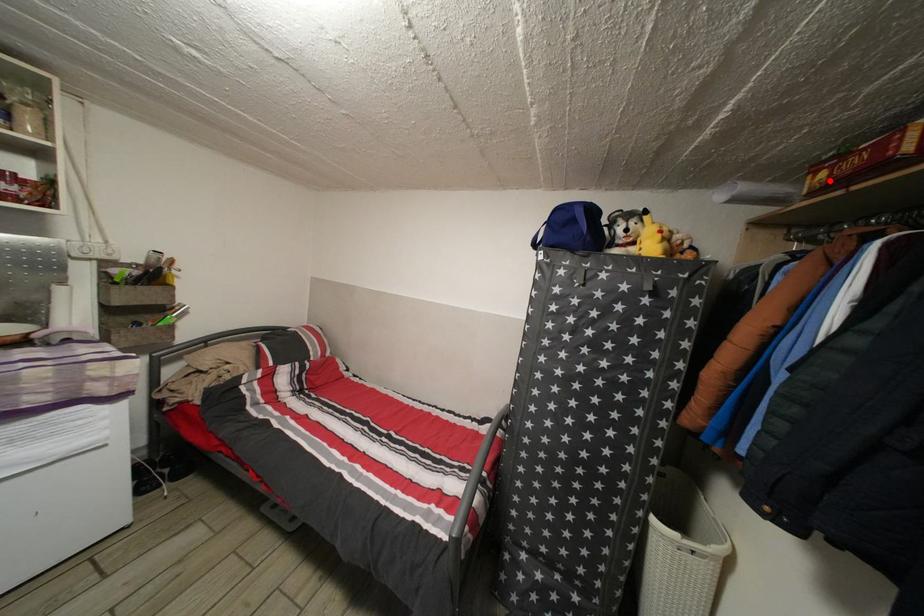
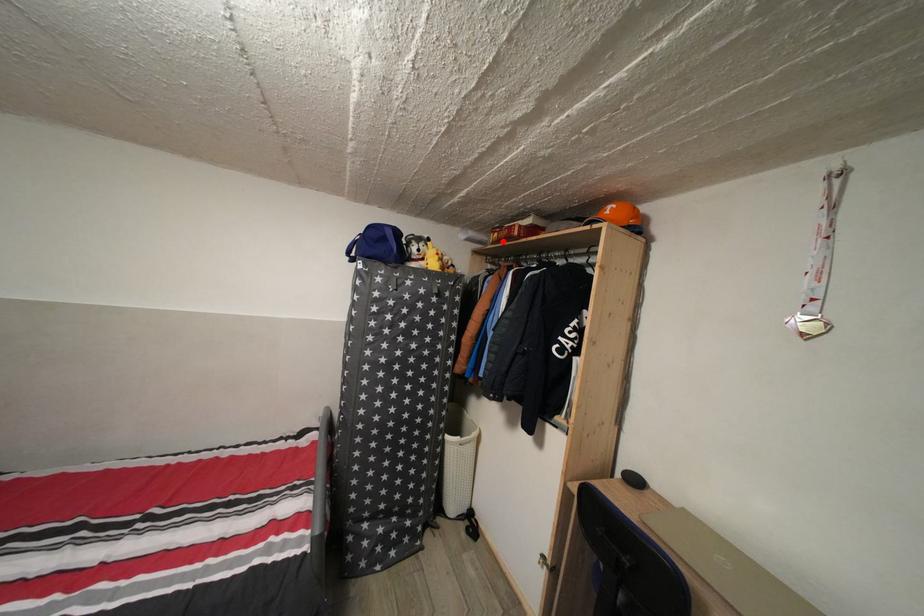
I am providing you with two images of the same scene from different viewpoints. A red point is marked on the first image and another point is marked on the second image. Is the marked point in image1 the same physical position as the marked point in image2?

Yes